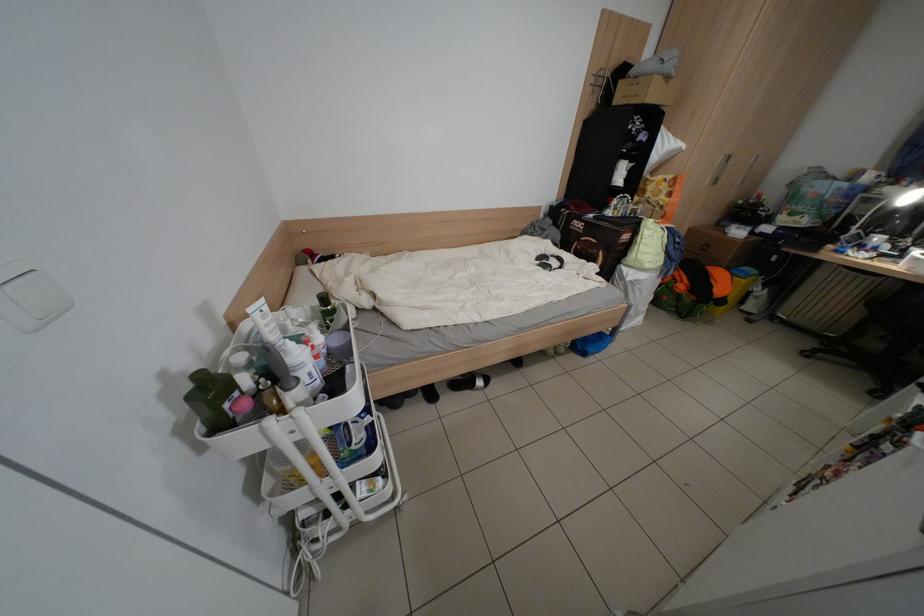
Find where to pull the wardrobe handle. Please return your answer as a coordinate pair (x, y).

(721, 169)